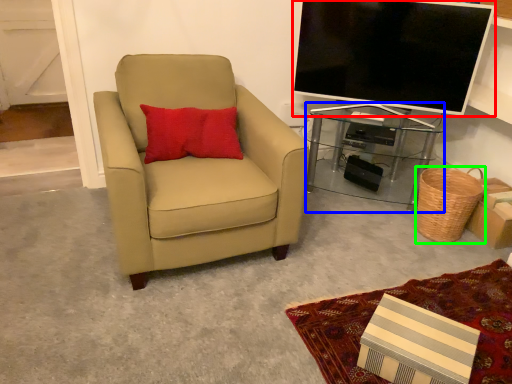
Question: Which is farther away from television (highlighted by a red box)? desk (highlighted by a blue box) or basket (highlighted by a green box)?

Choices:
 (A) desk
 (B) basket

Answer: (B)